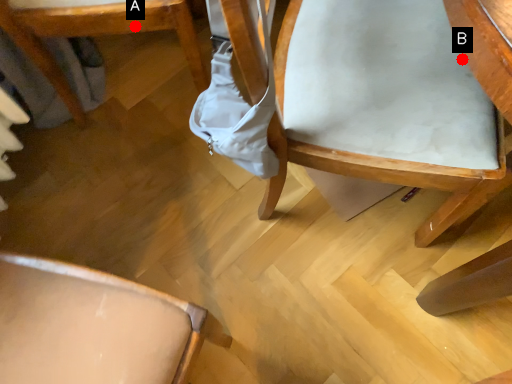
Question: Two points are circled on the image, labeled by A and B beside each circle. Which of the following is the farthest from the observer?

Choices:
 (A) A is further
 (B) B is further

Answer: (A)